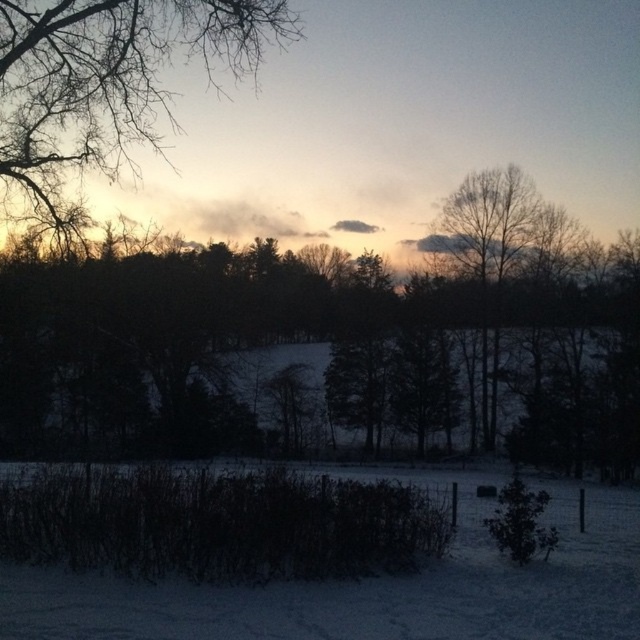
Does white powdery snow at lower center have a greater height compared to bare branches at upper left?

No, white powdery snow at lower center is not taller than bare branches at upper left.

Can you confirm if white powdery snow at lower center is positioned to the left of bare branches at upper left?

No, white powdery snow at lower center is not to the left of bare branches at upper left.

Find the location of a particular element. white powdery snow at lower center is located at coordinates (371, 589).